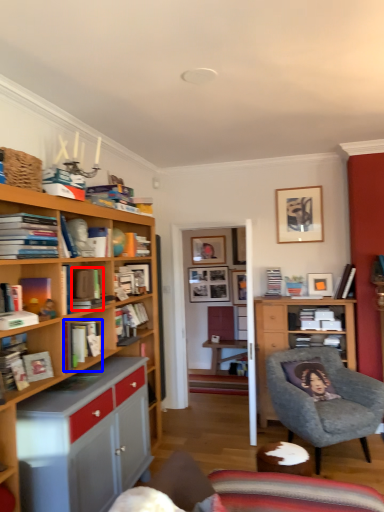
Question: Which object appears farthest to the camera in this image, book (highlighted by a red box) or book (highlighted by a blue box)?

Choices:
 (A) book
 (B) book

Answer: (B)